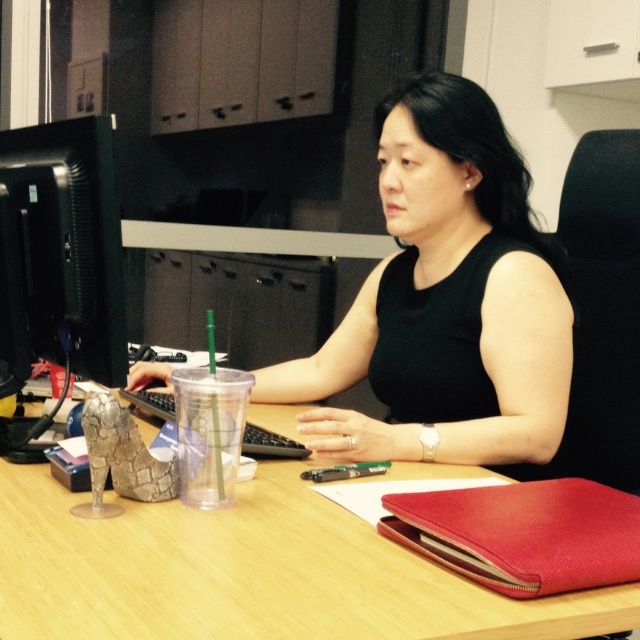
Question: Does black matte dress at center appear on the right side of wooden table at center?

Choices:
 (A) yes
 (B) no

Answer: (A)

Question: Based on their relative distances, which object is farther from the black matte dress at center?

Choices:
 (A) wooden table at center
 (B) black matte computer monitor at left

Answer: (B)

Question: Is black matte dress at center bigger than black matte computer monitor at left?

Choices:
 (A) yes
 (B) no

Answer: (A)

Question: Which point is closer to the camera?

Choices:
 (A) black matte computer monitor at left
 (B) black matte dress at center
 (C) wooden table at center

Answer: (C)

Question: Observing the image, what is the correct spatial positioning of wooden table at center in reference to black matte computer monitor at left?

Choices:
 (A) below
 (B) above

Answer: (A)

Question: Which point is farther to the camera?

Choices:
 (A) wooden table at center
 (B) black matte dress at center
 (C) black matte computer monitor at left

Answer: (B)